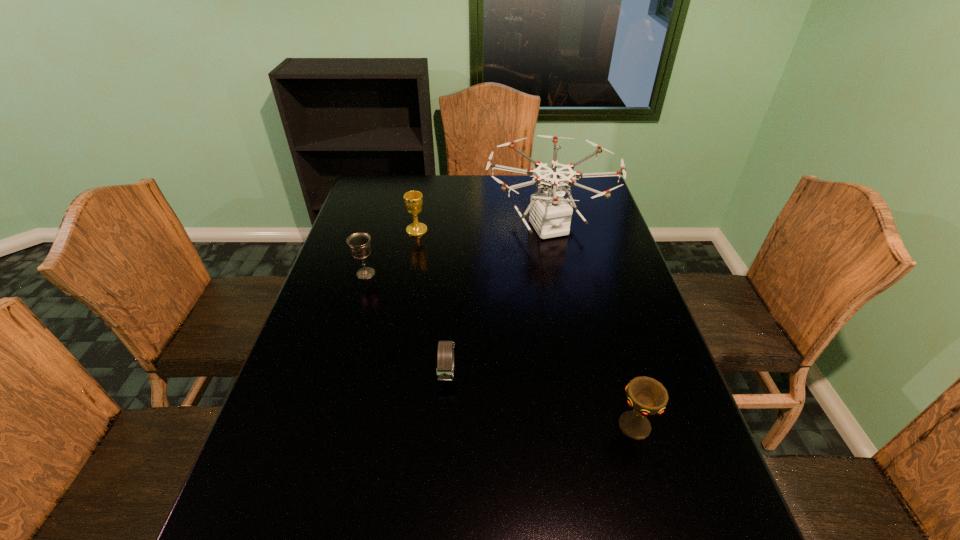
Where is `blank area located 0.160m on the right of the farthest chalice`? blank area located 0.160m on the right of the farthest chalice is located at coordinates (475, 230).

Locate an element on the screen. vacant space positioned on the back of the leftmost chalice is located at coordinates tap(388, 199).

Locate an element on the screen. Image resolution: width=960 pixels, height=540 pixels. vacant area situated 0.320m on the back of the nearest object is located at coordinates (600, 306).

Locate an element on the screen. vacant space located on the face of the watch is located at coordinates (444, 430).

The image size is (960, 540). Identify the location of object that is positioned at the far edge. (550, 214).

I want to click on object that is positioned at the left edge, so 359,243.

Locate an element on the screen. Image resolution: width=960 pixels, height=540 pixels. drone located at the right edge is located at coordinates (550, 214).

Identify the location of chalice that is at the right edge. The image size is (960, 540). tap(647, 396).

At what (x,y) coordinates should I click in order to perform the action: click on object that is at the far right corner. Please return your answer as a coordinate pair (x, y). Looking at the image, I should click on (550, 214).

This screenshot has width=960, height=540. Identify the location of free location at the far edge of the desktop. (492, 184).